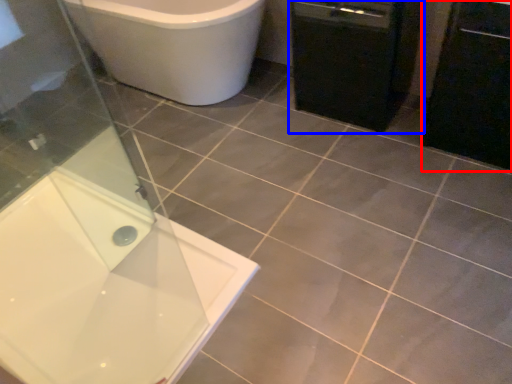
Question: Which point is closer to the camera, cabinetry (highlighted by a red box) or dish washer (highlighted by a blue box)?

Choices:
 (A) cabinetry
 (B) dish washer

Answer: (A)